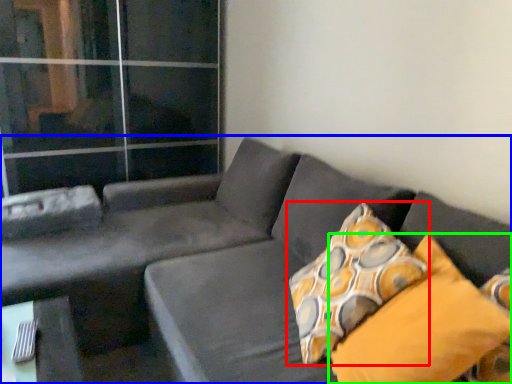
Question: Which is nearer to the pillow (highlighted by a red box)? studio couch (highlighted by a blue box) or pillow (highlighted by a green box).

Choices:
 (A) studio couch
 (B) pillow

Answer: (B)